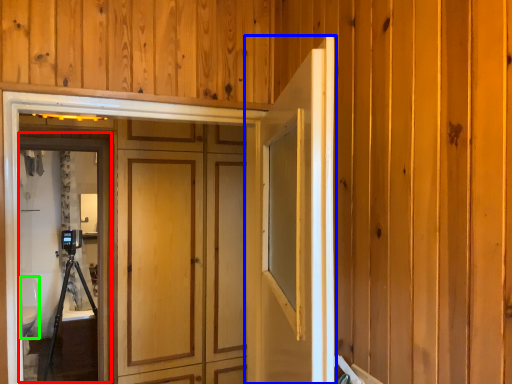
Question: Estimate the real-world distances between objects in this image. Which object is farther from screen door (highlighted by a red box), door (highlighted by a blue box) or toilet bowl (highlighted by a green box)?

Choices:
 (A) door
 (B) toilet bowl

Answer: (A)